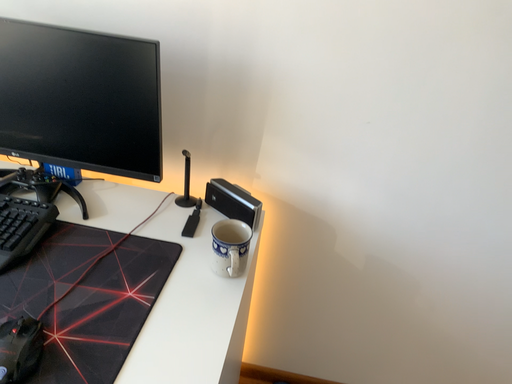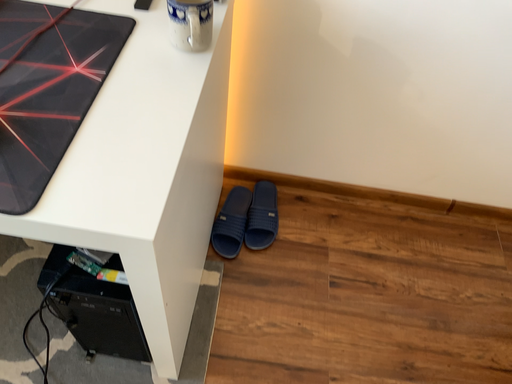
Question: Which way did the camera rotate in the video?

Choices:
 (A) rotated upward
 (B) rotated downward

Answer: (B)